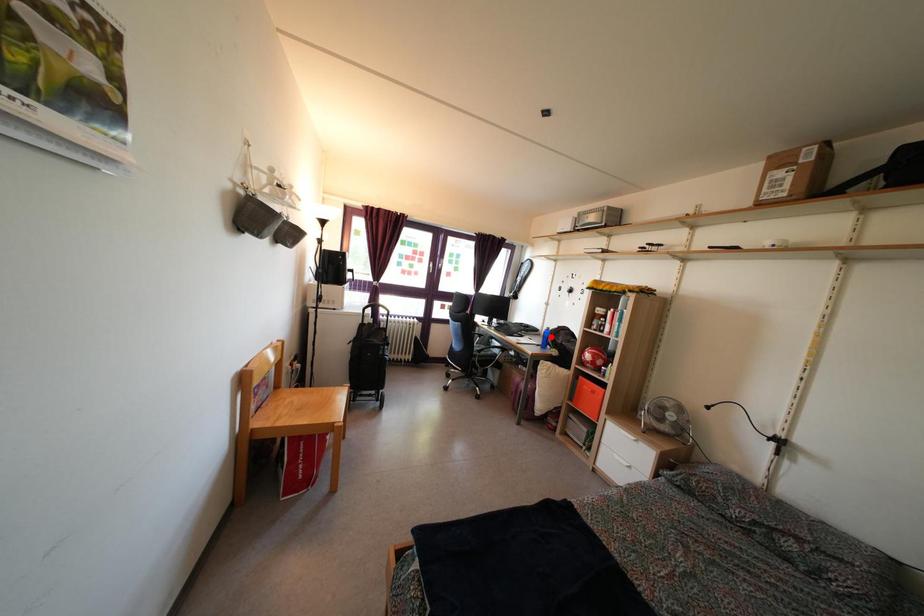
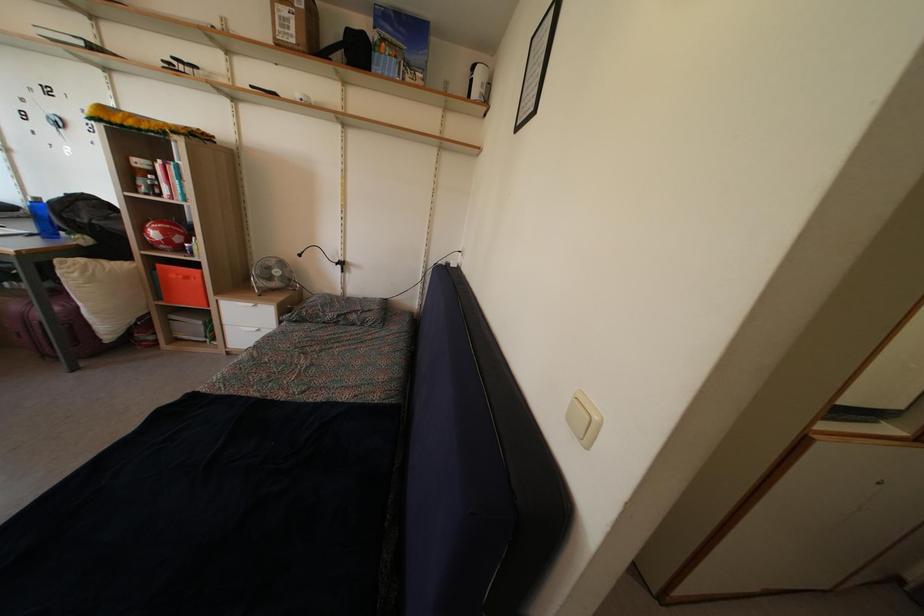
In the second image, find the point that corresponds to the highlighted location in the first image.

(40, 208)